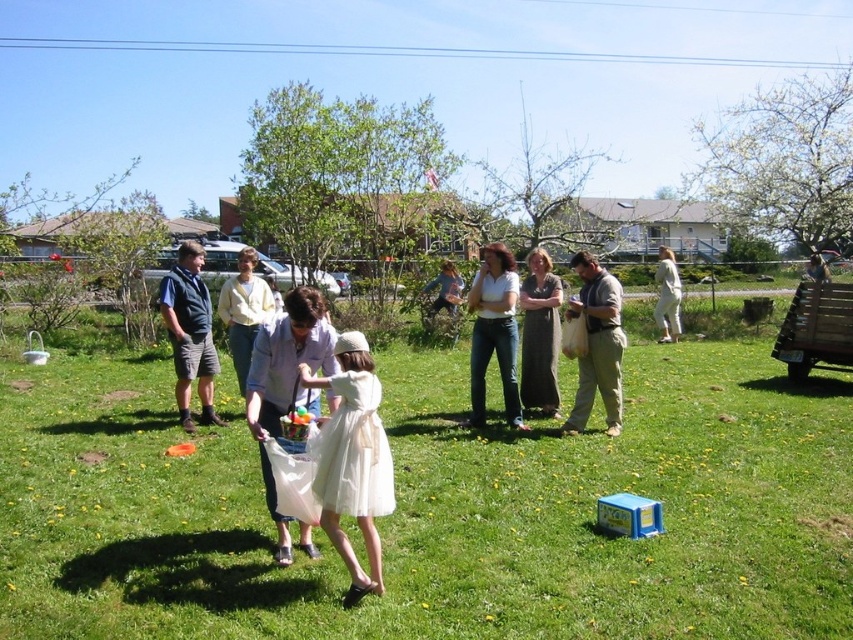
You are standing at the point with coordinates point (161,282) and want to move towards the point with coordinates point (428,577). Since you can only move forward, will you get closer to the camera as you move towards your destination?

Yes, because point (428,577) is closer to the camera than point (161,282), so moving towards it will bring you closer to the camera.

You are standing at the camera position and want to throw a ball to reach both the point at coordinates (x=503, y=292) and the point at coordinates (x=532, y=397). Which point should you aim for first if you want to reach them in order from closest to farthest?

You should aim for point (x=503, y=292) first because it is closer to the camera than point (x=532, y=397).

You are standing at point (505, 332) and want to walk to point (573, 305). Which direction should you move relative to your current position?

Point (573, 305) is in front of point (505, 332), so you should move forward to reach it.